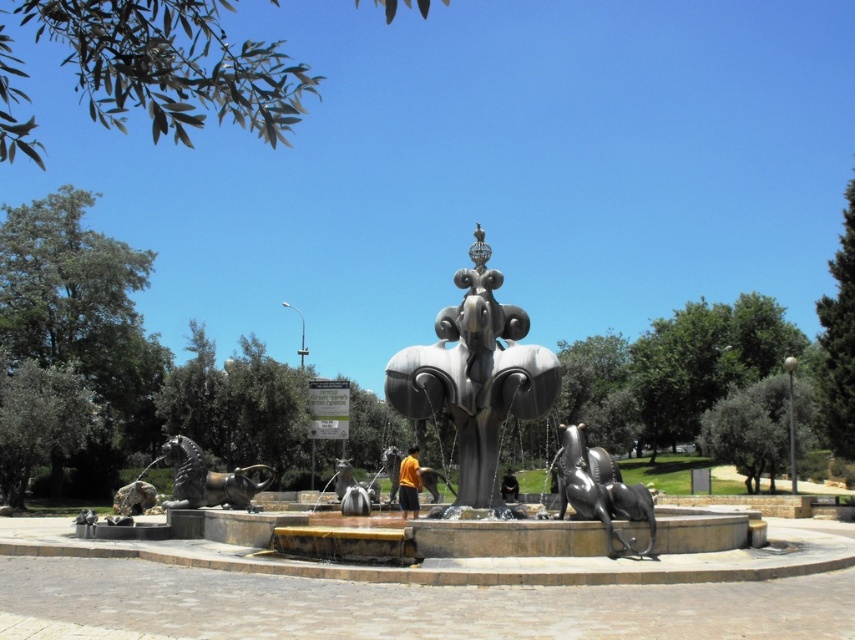
Is point (363, 541) closer to viewer compared to point (599, 460)?

Yes, point (363, 541) is closer to viewer.

Which is more to the left, polished silver fountain at center or black polished horse at lower right?

polished silver fountain at center is more to the left.

Is point (183, 534) closer to viewer compared to point (582, 451)?

No, it is behind (582, 451).

The image size is (855, 640). I want to click on polished silver fountain at center, so click(x=499, y=440).

Which is behind, point (604, 476) or point (201, 490)?

Point (201, 490)

What do you see at coordinates (599, 490) in the screenshot? This screenshot has height=640, width=855. I see `black polished horse at lower right` at bounding box center [599, 490].

Find the location of a particular element. The height and width of the screenshot is (640, 855). black polished horse at lower right is located at coordinates (599, 490).

Who is more distant from viewer, [517,390] or [573,506]?

The point [517,390] is behind.

Is polished silver sculpture at center wider than black polished horse at lower right?

Incorrect, polished silver sculpture at center's width does not surpass black polished horse at lower right's.

Does point (541, 388) come in front of point (596, 477)?

No, (541, 388) is further to viewer.

At what (x,y) coordinates should I click in order to perform the action: click on polished silver sculpture at center. Please return your answer as a coordinate pair (x, y). Image resolution: width=855 pixels, height=640 pixels. Looking at the image, I should click on tap(475, 376).